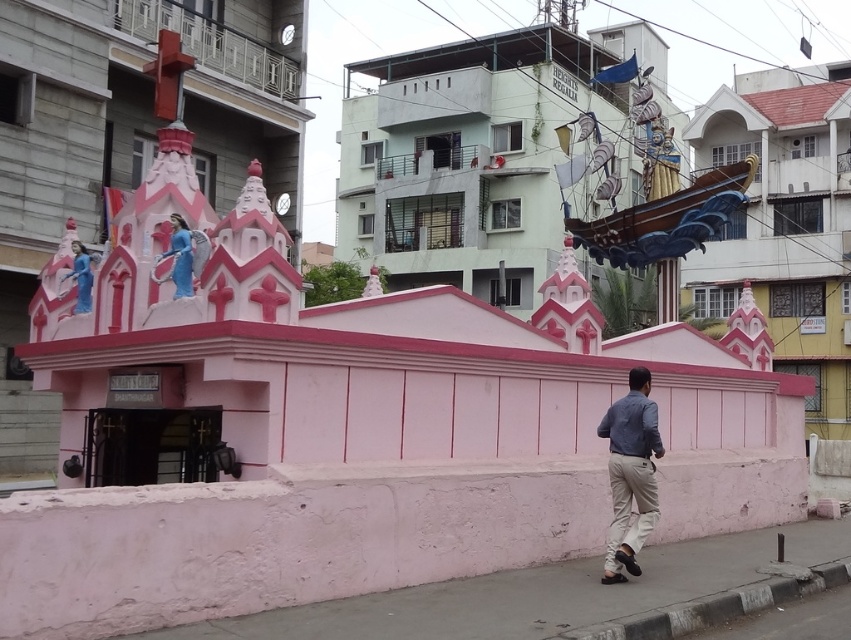
Question: Does gray concrete pavement at lower right lie behind denim shirt at lower right?

Choices:
 (A) yes
 (B) no

Answer: (B)

Question: Is denim shirt at lower right above matte blue statue at upper center?

Choices:
 (A) no
 (B) yes

Answer: (A)

Question: Considering the real-world distances, which object is closest to the gray concrete pavement at lower right?

Choices:
 (A) blue glossy statue at upper left
 (B) matte blue statue at upper center
 (C) denim shirt at lower right

Answer: (C)

Question: Which object is farther from the camera taking this photo?

Choices:
 (A) blue glossy statue at upper left
 (B) matte blue statue at upper center
 (C) gray concrete pavement at lower right

Answer: (A)

Question: Does gray concrete pavement at lower right lie in front of blue glossy statue at upper left?

Choices:
 (A) yes
 (B) no

Answer: (A)

Question: Which point is farther to the camera?

Choices:
 (A) denim shirt at lower right
 (B) blue glossy statue at upper left
 (C) matte blue statue at upper center

Answer: (B)